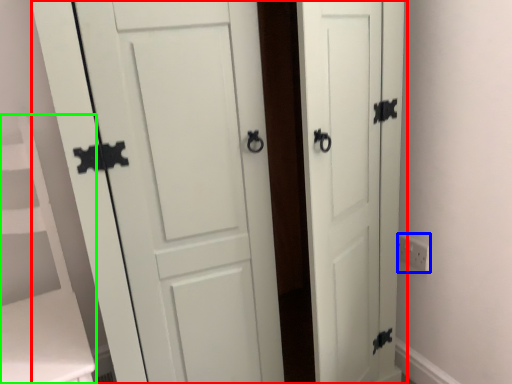
Question: Considering the real-world distances, which object is farthest from door (highlighted by a red box)? electric outlet (highlighted by a blue box) or vanity (highlighted by a green box)?

Choices:
 (A) electric outlet
 (B) vanity

Answer: (A)